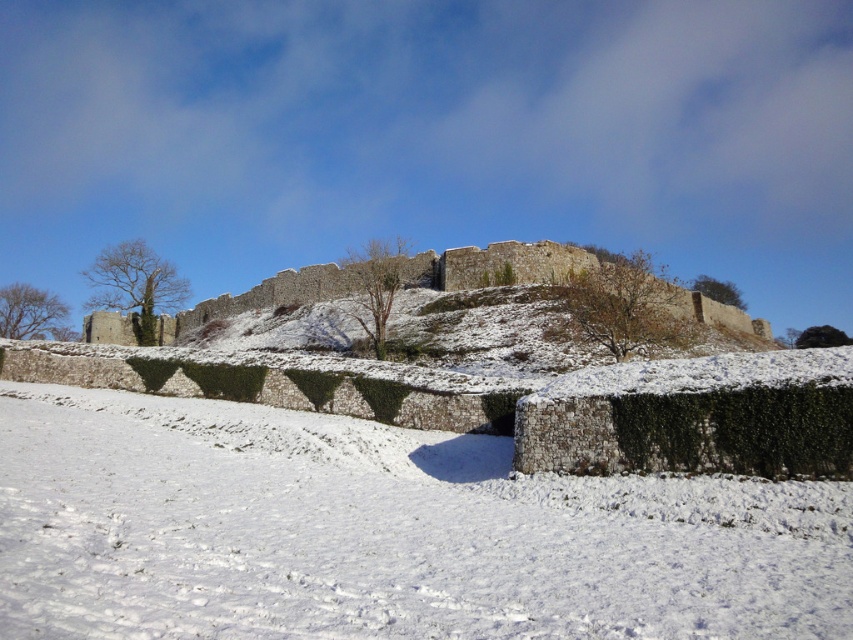
Who is positioned more to the right, white fluffy snow at center or snow-covered stone wall at center?

white fluffy snow at center is more to the right.

Is white fluffy snow at center thinner than snow-covered stone wall at center?

Correct, white fluffy snow at center's width is less than snow-covered stone wall at center's.

Is point (804, 522) positioned after point (206, 301)?

That is False.

The height and width of the screenshot is (640, 853). I want to click on white fluffy snow at center, so click(381, 532).